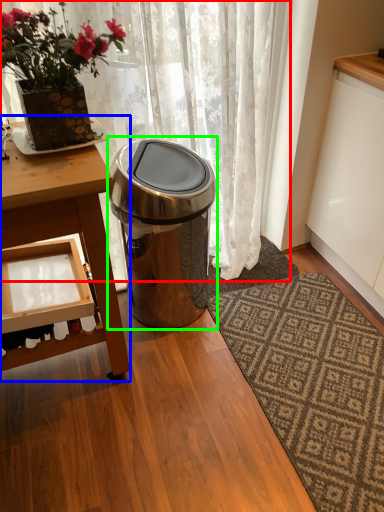
Question: Which object is positioned closest to curtain (highlighted by a red box)? Select from table (highlighted by a blue box) and trash bin/can (highlighted by a green box).

Choices:
 (A) table
 (B) trash bin/can

Answer: (B)